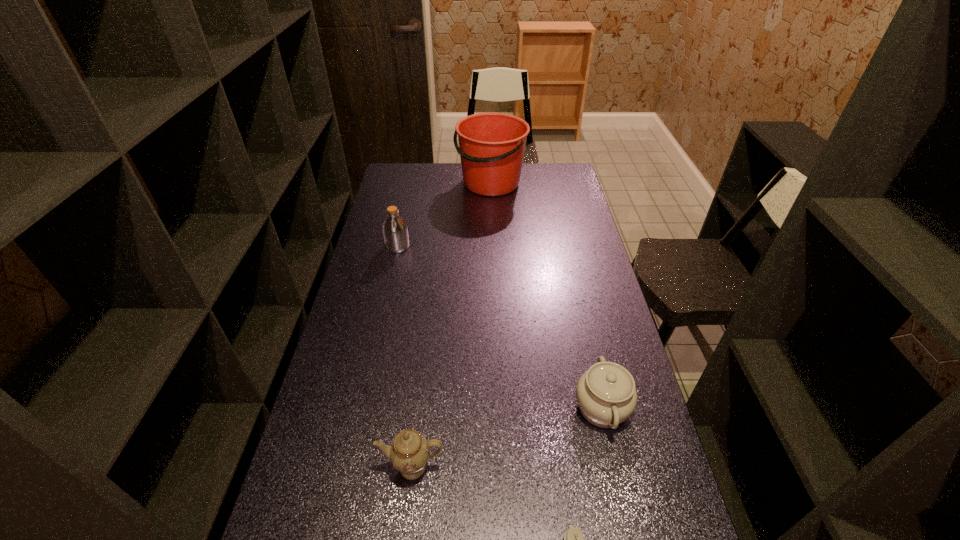
Identify the location of free spot between the left chinaware and the farthest object. The width and height of the screenshot is (960, 540). (451, 325).

Locate an element on the screen. vacant area that lies between the bottle and the bucket is located at coordinates (444, 215).

Choose which object is the fourth nearest neighbor to the camera. Please provide its 2D coordinates. Your answer should be formatted as a tuple, i.e. [(x, y)], where the tuple contains the x and y coordinates of a point satisfying the conditions above.

[(491, 145)]

Find the location of a particular element. object identified as the third closest to the bottle is located at coordinates (409, 453).

This screenshot has height=540, width=960. Identify the location of vacant area that satisfies the following two spatial constraints: 1. on the front side of the leftmost object; 2. on the left side of the right chinaware. (362, 408).